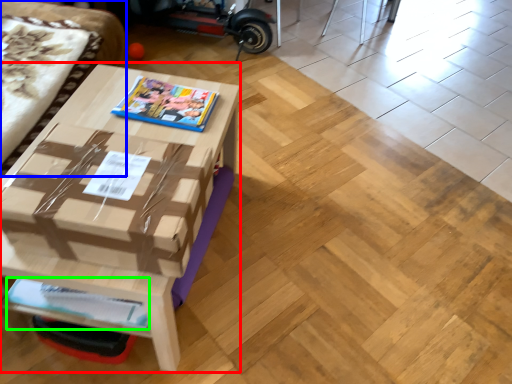
Question: Considering the real-world distances, which object is closest to table (highlighted by a red box)? couch (highlighted by a blue box) or magazine (highlighted by a green box).

Choices:
 (A) couch
 (B) magazine

Answer: (B)